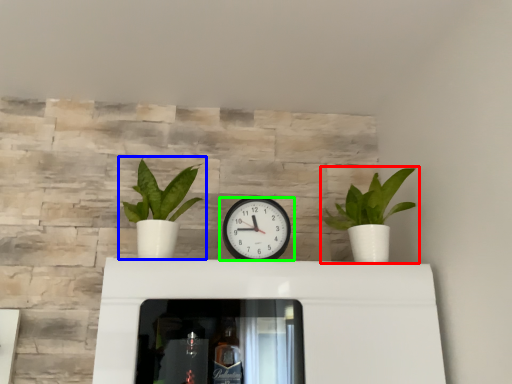
Question: Which is nearer to the houseplant (highlighted by a red box)? houseplant (highlighted by a blue box) or wall clock (highlighted by a green box).

Choices:
 (A) houseplant
 (B) wall clock

Answer: (B)